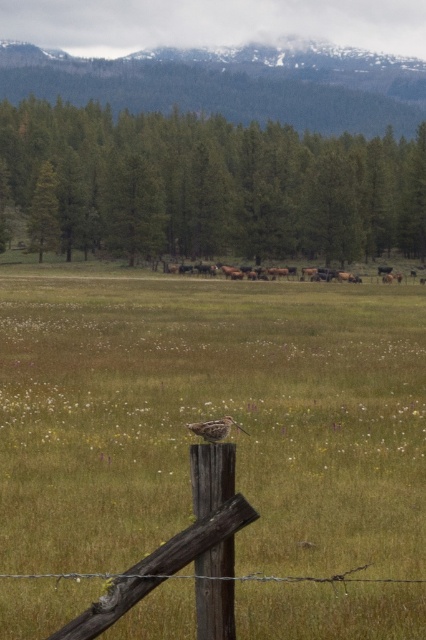
Does green matte tree at center have a smaller size compared to brown furry cows at center?

No.

From the picture: Does green matte tree at center have a larger size compared to brown furry cows at center?

Yes, green matte tree at center is bigger than brown furry cows at center.

At what (x,y) coordinates should I click in order to perform the action: click on green matte tree at center. Please return your answer as a coordinate pair (x, y). Looking at the image, I should click on (216, 182).

Does weathered wood post at center appear over brown furry cows at center?

No, weathered wood post at center is not above brown furry cows at center.

Is weathered wood post at center to the right of brown furry cows at center from the viewer's perspective?

Incorrect, weathered wood post at center is not on the right side of brown furry cows at center.

Between point (356, 490) and point (186, 269), which one is positioned behind?

Point (186, 269)

Find the location of a particular element. weathered wood post at center is located at coordinates (330, 520).

Is weathered wood post at center to the right of brown speckled bird at center from the viewer's perspective?

No, weathered wood post at center is not to the right of brown speckled bird at center.

Is weathered wood post at center wider than brown speckled bird at center?

Yes, weathered wood post at center is wider than brown speckled bird at center.

Is point (287, 595) farther from viewer compared to point (190, 428)?

Yes, it is behind point (190, 428).

The image size is (426, 640). Find the location of `weathered wood post at center`. weathered wood post at center is located at coordinates (330, 520).